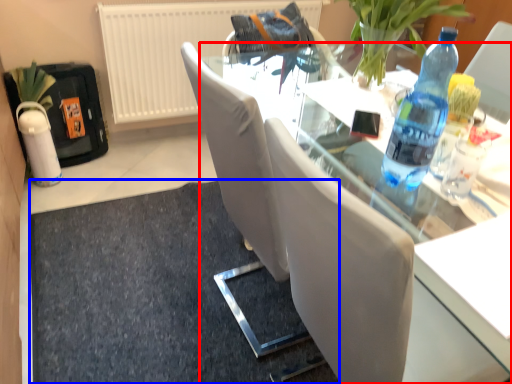
Question: Which of the following is the farthest to the observer, table (highlighted by a red box) or doormat (highlighted by a blue box)?

Choices:
 (A) table
 (B) doormat

Answer: (B)